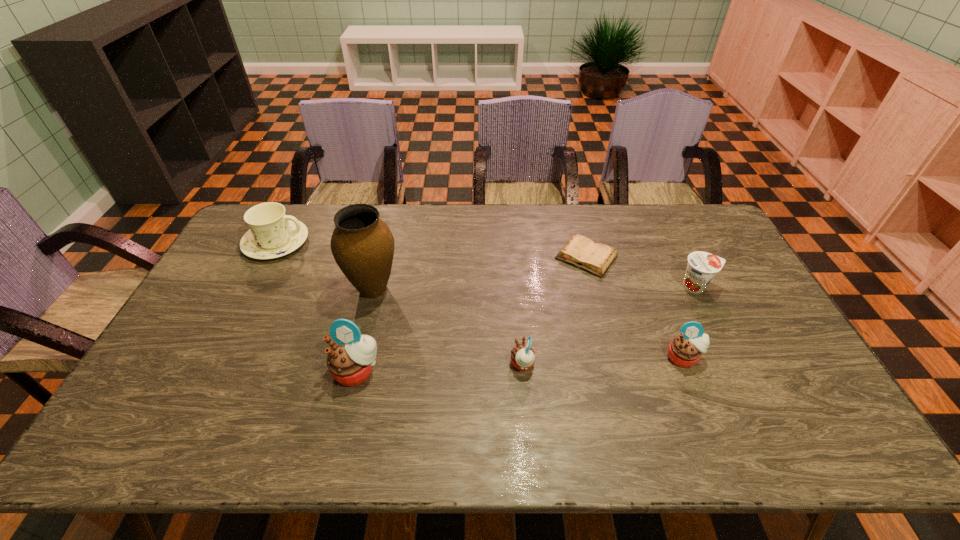
The width and height of the screenshot is (960, 540). I want to click on vacant space that's between the tallest object and the second shortest muffin, so click(x=528, y=323).

This screenshot has width=960, height=540. Find the location of `object that is the second closest one to the sixth object from left to right`. object that is the second closest one to the sixth object from left to right is located at coordinates (580, 251).

This screenshot has width=960, height=540. I want to click on object that stands as the closest to the diary, so click(702, 266).

Identify the location of muffin that stands as the second closest to the second object from right to left. The image size is (960, 540). (350, 360).

Locate which muffin is the closest to the yogurt. Please provide its 2D coordinates. Your answer should be formatted as a tuple, i.e. [(x, y)], where the tuple contains the x and y coordinates of a point satisfying the conditions above.

[(685, 350)]

In order to click on free space that satisfies the following two spatial constraints: 1. on the back side of the urn; 2. on the handle side of the leftmost object in this screenshot , I will do `click(385, 243)`.

Identify the location of vacant area in the image that satisfies the following two spatial constraints: 1. on the back side of the fifth object from left to right; 2. on the handle side of the chinaware. The width and height of the screenshot is (960, 540). (583, 243).

The width and height of the screenshot is (960, 540). I want to click on vacant space that satisfies the following two spatial constraints: 1. on the front-facing side of the second tallest muffin; 2. on the front-facing side of the fourth object from right to left, so click(x=686, y=364).

Where is `free space that satisfies the following two spatial constraints: 1. on the handle side of the chinaware; 2. on the left side of the yogurt`? Image resolution: width=960 pixels, height=540 pixels. free space that satisfies the following two spatial constraints: 1. on the handle side of the chinaware; 2. on the left side of the yogurt is located at coordinates (253, 287).

The width and height of the screenshot is (960, 540). Identify the location of free spot that satisfies the following two spatial constraints: 1. on the handle side of the chinaware; 2. on the right side of the shortest object. (269, 257).